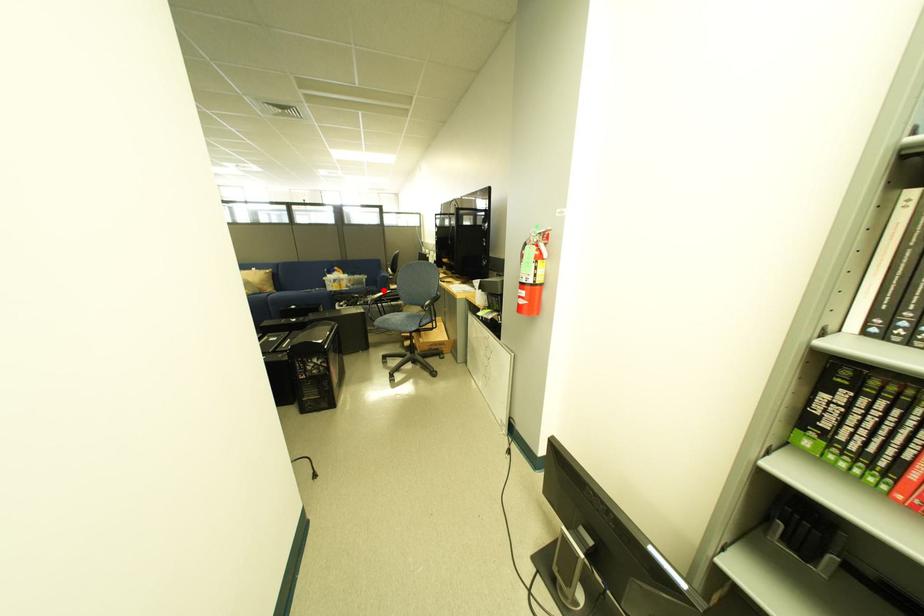
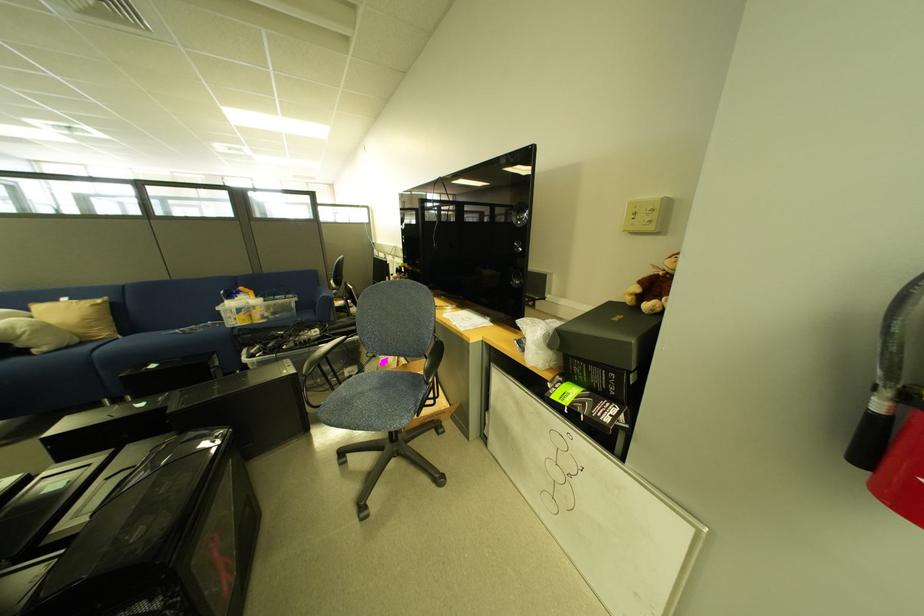
The point at the highlighted location is marked in the first image. Where is the corresponding point in the second image?

(319, 318)